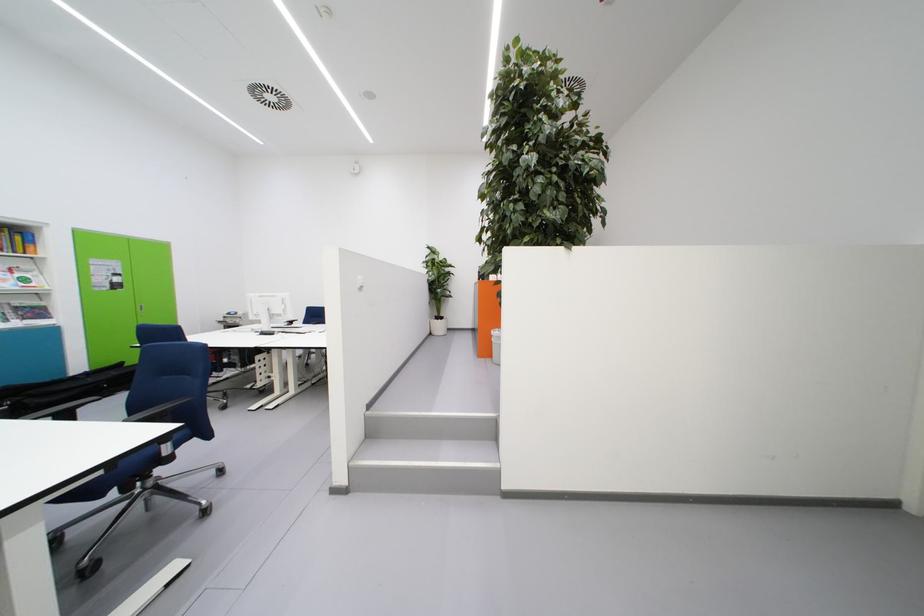
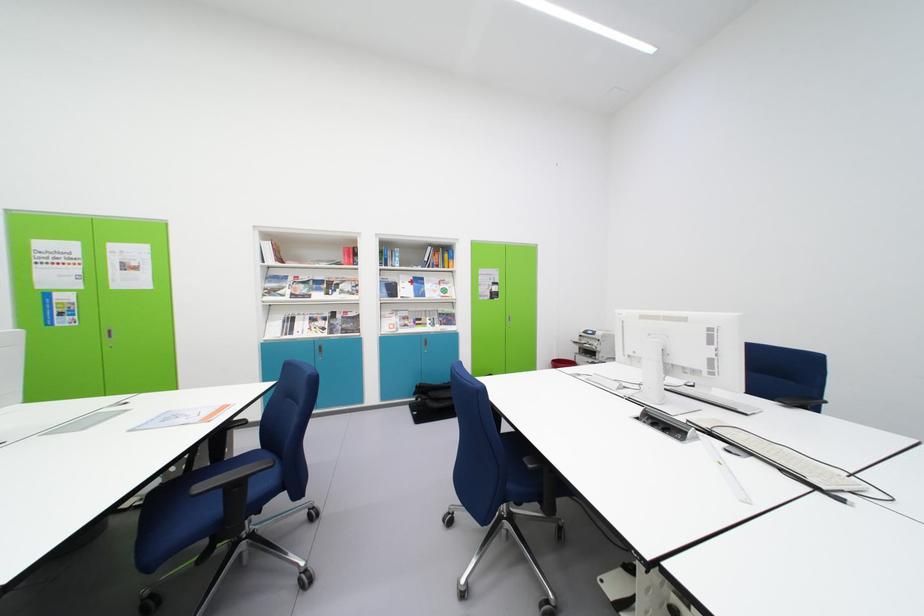
Where in the second image is the point corresponding to [53,403] from the first image?

(442, 408)